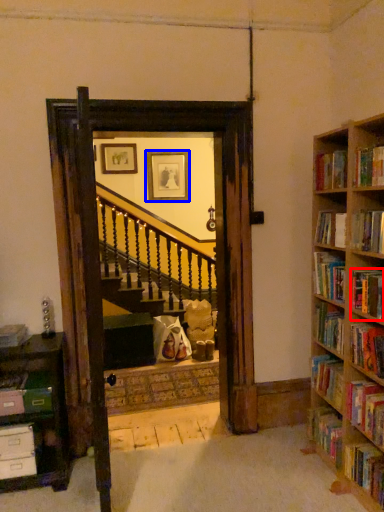
Question: Among these objects, which one is nearest to the camera, book (highlighted by a red box) or picture frame (highlighted by a blue box)?

Choices:
 (A) book
 (B) picture frame

Answer: (A)